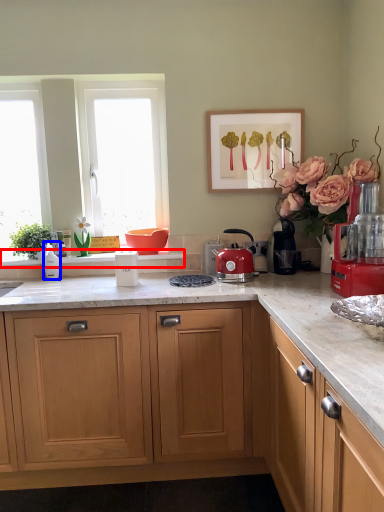
Question: Which point is further to the camera, window sill (highlighted by a red box) or kitchen appliance (highlighted by a blue box)?

Choices:
 (A) window sill
 (B) kitchen appliance

Answer: (A)